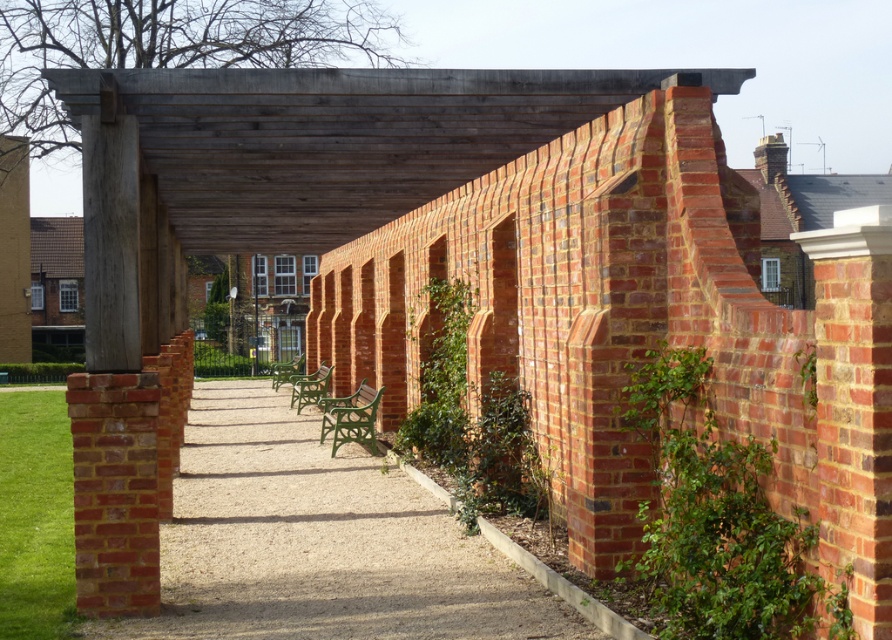
You are standing on the red brick path at center and want to walk towards the red brick wall at left. Which direction should you go to reach the wall?

To reach the red brick wall at left from the red brick path at center, you should walk to the left since the path is positioned on the left side of the wall.

You are standing on the red brick path at center and want to take a photo of the red brick wall at left. Which direction should you face to capture the wall in your shot?

Since the red brick path at center is below the red brick wall at left, you should face upward to capture the wall in your photo.